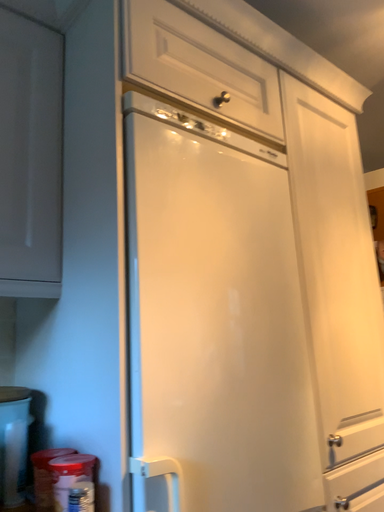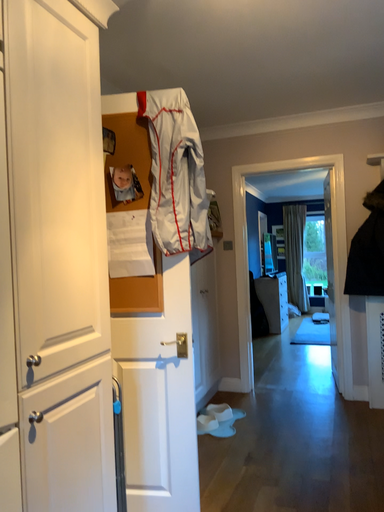
Question: Which way did the camera rotate in the video?

Choices:
 (A) rotated downward
 (B) rotated upward

Answer: (A)